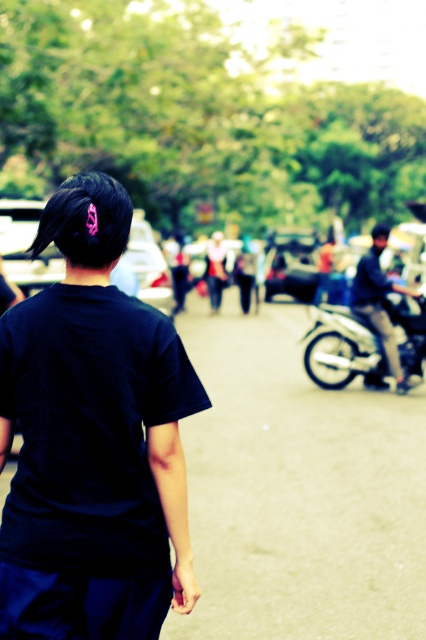
You are a photographer trying to capture a clear shot of the metallic silver motorcycle at right and the dark blue jeans at center. Which object should you focus on first if you want the other to appear blurred in the background?

The metallic silver motorcycle at right is located below the dark blue jeans at center. To have one object blurred while the other is in focus, you should focus on the metallic silver motorcycle at right first since it is closer to the camera than the dark blue jeans at center.

In the scene shown: You are a photographer trying to capture a clear shot of the person in the black matte shirt at center and the person in the matte white shirt at center. Based on their positions, which one is closer to the camera?

The black matte shirt at center is closer to the camera because it is in front of the matte white shirt at center.